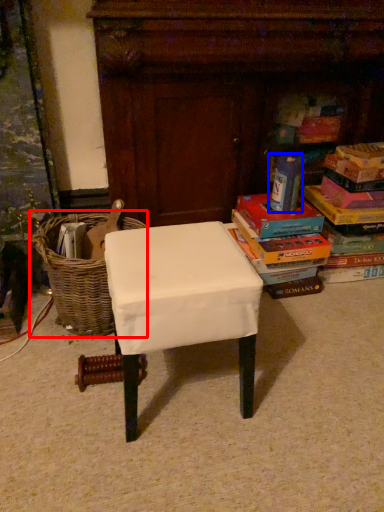
Question: Which object is closer to the camera taking this photo, basket (highlighted by a red box) or paperback book (highlighted by a blue box)?

Choices:
 (A) basket
 (B) paperback book

Answer: (A)